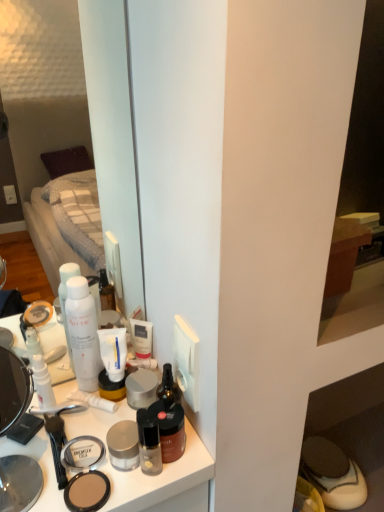
Question: Can you confirm if matte plastic makeup at center is smaller than white matte pump bottle at upper left, which is the fourth toiletry from right to left?

Choices:
 (A) yes
 (B) no

Answer: (B)

Question: From a real-world perspective, is matte plastic makeup at center physically below white matte pump bottle at upper left, the first toiletry viewed from the left?

Choices:
 (A) no
 (B) yes

Answer: (B)

Question: Is matte plastic makeup at center wider than white matte pump bottle at upper left, which is the fourth toiletry from right to left?

Choices:
 (A) yes
 (B) no

Answer: (A)

Question: Does matte plastic makeup at center have a larger size compared to white matte pump bottle at upper left, the first toiletry viewed from the left?

Choices:
 (A) no
 (B) yes

Answer: (B)

Question: Could white matte pump bottle at upper left, the first toiletry viewed from the left, be considered to be inside matte plastic makeup at center?

Choices:
 (A) yes
 (B) no

Answer: (B)

Question: From the image's perspective, relative to white matte tube at center, is white matte spray can at center, the second toiletry when ordered from left to right, above or below?

Choices:
 (A) above
 (B) below

Answer: (A)

Question: From a real-world perspective, is white matte spray can at center, the third toiletry in the right-to-left sequence, above or below white matte tube at center?

Choices:
 (A) above
 (B) below

Answer: (A)

Question: Based on their sizes in the image, would you say white matte spray can at center, the second toiletry when ordered from left to right, is bigger or smaller than white matte tube at center?

Choices:
 (A) small
 (B) big

Answer: (B)

Question: In the image, is white matte spray can at center, the third toiletry in the right-to-left sequence, positioned in front of or behind white matte tube at center?

Choices:
 (A) behind
 (B) front

Answer: (B)

Question: Considering their positions, is translucent glass bottle at center, which ranks as the third toiletry in left-to-right order, located in front of or behind white matte spray can at center, the third toiletry in the right-to-left sequence?

Choices:
 (A) behind
 (B) front

Answer: (B)

Question: Is translucent glass bottle at center, which is the 2th toiletry from right to left, inside or outside of white matte spray can at center, the second toiletry when ordered from left to right?

Choices:
 (A) outside
 (B) inside

Answer: (A)

Question: In terms of width, does translucent glass bottle at center, which ranks as the third toiletry in left-to-right order, look wider or thinner when compared to white matte spray can at center, the second toiletry when ordered from left to right?

Choices:
 (A) thin
 (B) wide

Answer: (A)

Question: Is point (145, 433) closer or farther from the camera than point (82, 330)?

Choices:
 (A) closer
 (B) farther

Answer: (A)

Question: In terms of size, does matte brown shoe at lower right appear bigger or smaller than translucent glass bottle at center, which ranks as the third toiletry in left-to-right order?

Choices:
 (A) big
 (B) small

Answer: (A)

Question: From the image's perspective, relative to translucent glass bottle at center, which ranks as the third toiletry in left-to-right order, is matte brown shoe at lower right above or below?

Choices:
 (A) below
 (B) above

Answer: (A)